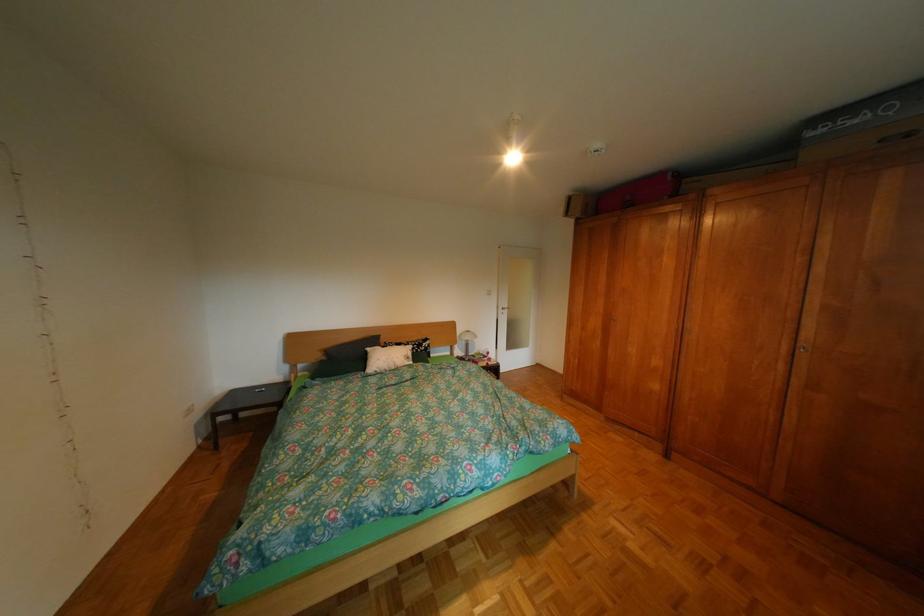
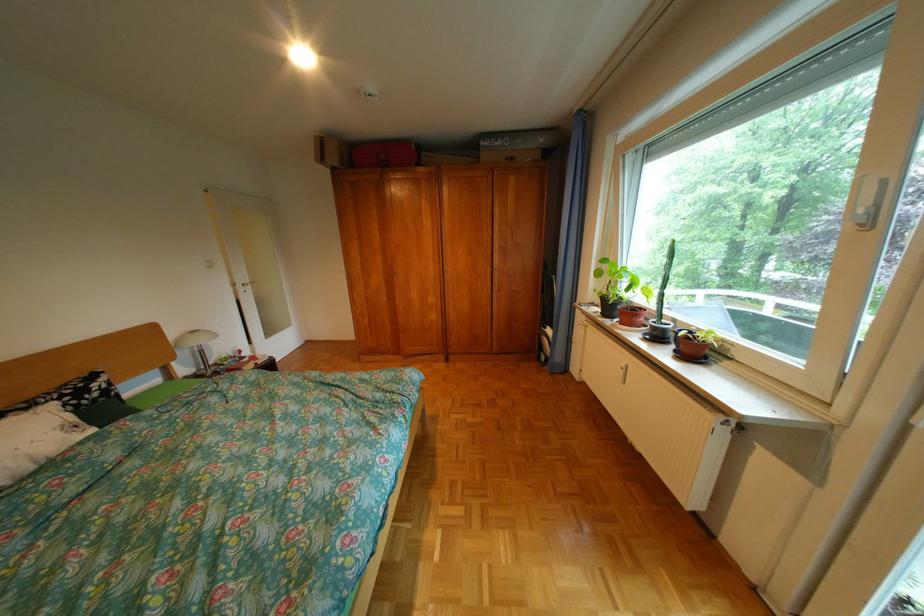
Where in the second image is the point corresponding to pixel 513 308 from the first image?

(248, 285)